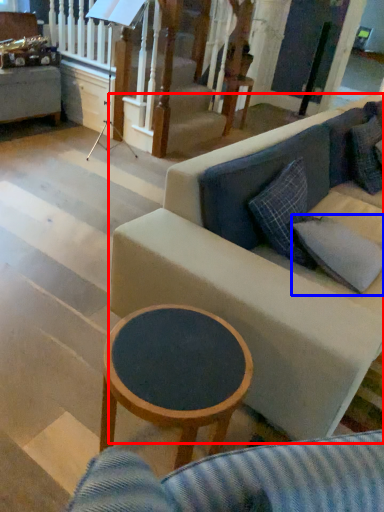
Question: Which object is further to the camera taking this photo, studio couch (highlighted by a red box) or pillow (highlighted by a blue box)?

Choices:
 (A) studio couch
 (B) pillow

Answer: (B)